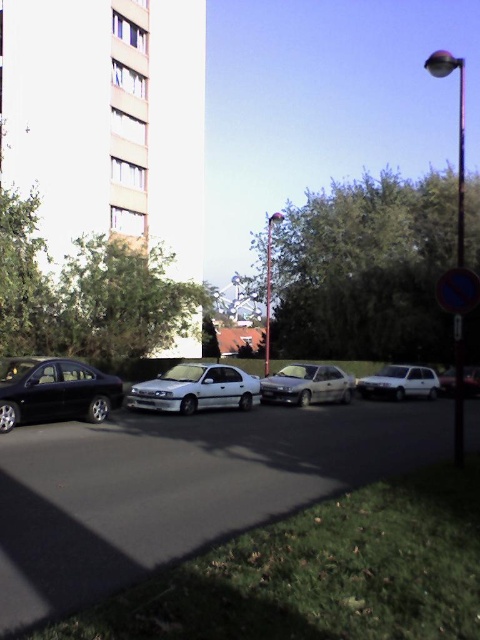
Does white glossy car at center lie in front of white matte car at lower right?

Yes, white glossy car at center is in front of white matte car at lower right.

Can you confirm if white glossy car at center is shorter than white matte car at lower right?

Yes.

Image resolution: width=480 pixels, height=640 pixels. What do you see at coordinates (195, 388) in the screenshot? I see `white glossy car at center` at bounding box center [195, 388].

Locate an element on the screen. The height and width of the screenshot is (640, 480). white glossy car at center is located at coordinates (195, 388).

Is shiny black sedan at left further to the viewer compared to white matte car at lower right?

No, shiny black sedan at left is closer to the viewer.

The image size is (480, 640). What do you see at coordinates (55, 392) in the screenshot? I see `shiny black sedan at left` at bounding box center [55, 392].

Identify the location of shiny black sedan at left. This screenshot has height=640, width=480. (55, 392).

Can you confirm if shiny black sedan at left is thinner than white glossy car at center?

Yes.

Is point (50, 380) positioned before point (201, 364)?

Yes, it is in front of point (201, 364).

Which is behind, point (56, 362) or point (162, 394)?

The point (162, 394) is more distant.

This screenshot has width=480, height=640. I want to click on shiny black sedan at left, so click(55, 392).